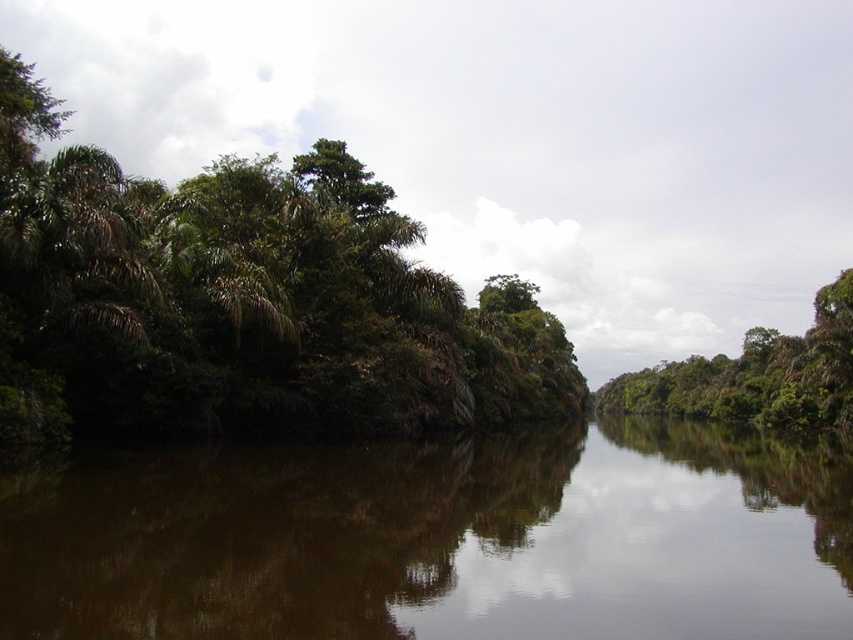
You are standing on a boat in the middle of the river. You see the brown reflective water at center and the green leafy trees at left. Which object is closer to the water surface?

The brown reflective water at center is below green leafy trees at left, so the brown reflective water at center is closer to the water surface.

You are an ecologist studying the river ecosystem. You observe the green leafy trees at left and the green leafy tree at center. Which of these has a greater canopy spread?

The green leafy trees at left has a greater canopy spread than the green leafy tree at center because it is larger in size.

You are standing on a boat in the middle of the river and see the green leafy trees at left and the green leafy tree at center. Which group of trees is closer to you?

The green leafy trees at left are closer to you because they are in front of the green leafy tree at center.